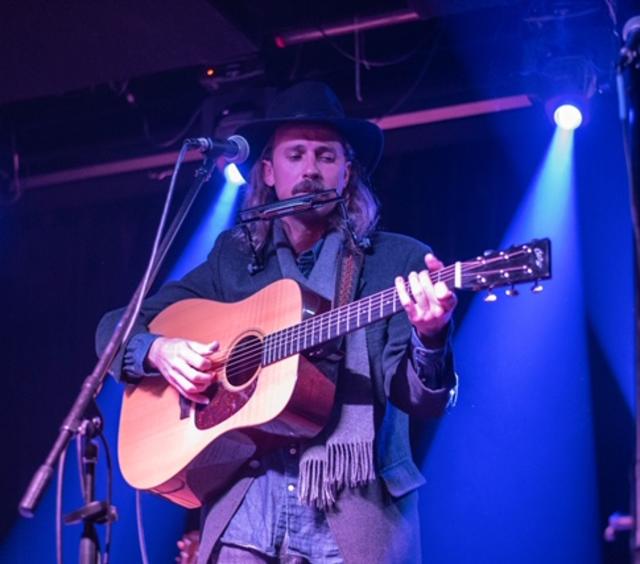
Locate an element on the screen. Image resolution: width=640 pixels, height=564 pixels. purple bar is located at coordinates (155, 158).